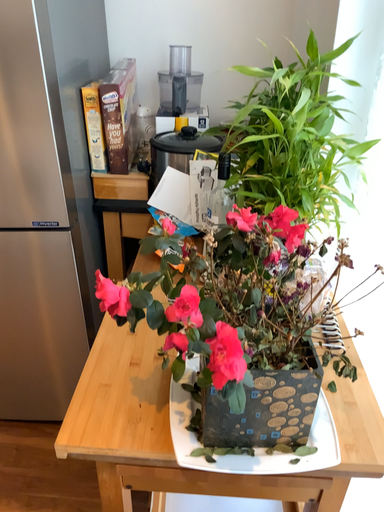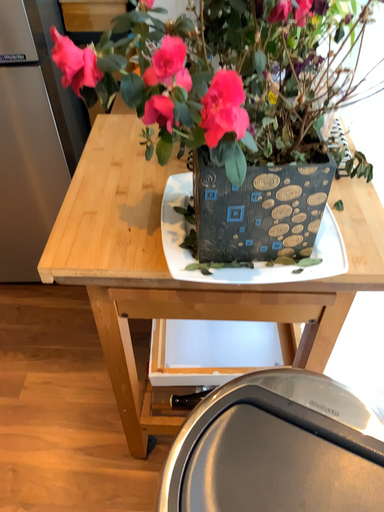
Question: How did the camera likely rotate when shooting the video?

Choices:
 (A) rotated downward
 (B) rotated upward

Answer: (A)